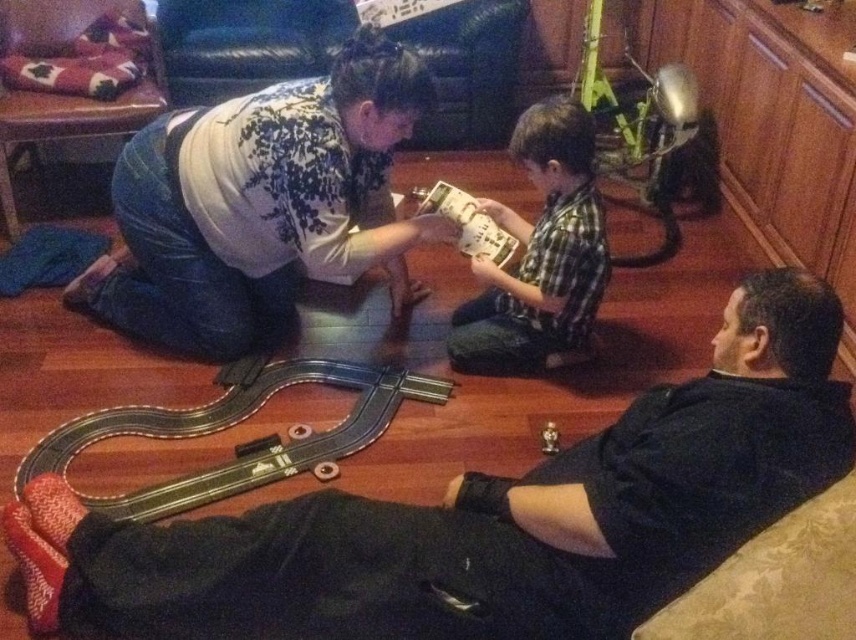
Question: Which point is closer to the camera?

Choices:
 (A) green plaid shirt at center
 (B) black matte couch at lower right
 (C) dark gray pants at center

Answer: (B)

Question: Is dark gray pants at center to the right of green plaid shirt at center from the viewer's perspective?

Choices:
 (A) no
 (B) yes

Answer: (A)

Question: Estimate the real-world distances between objects in this image. Which object is closer to the dark gray pants at center?

Choices:
 (A) black matte couch at lower right
 (B) green plaid shirt at center

Answer: (B)

Question: Does black matte couch at lower right appear over green plaid shirt at center?

Choices:
 (A) yes
 (B) no

Answer: (B)

Question: Does black matte couch at lower right appear on the left side of dark gray pants at center?

Choices:
 (A) yes
 (B) no

Answer: (B)

Question: Which object is farther from the camera taking this photo?

Choices:
 (A) green plaid shirt at center
 (B) black matte couch at lower right
 (C) dark gray pants at center

Answer: (A)